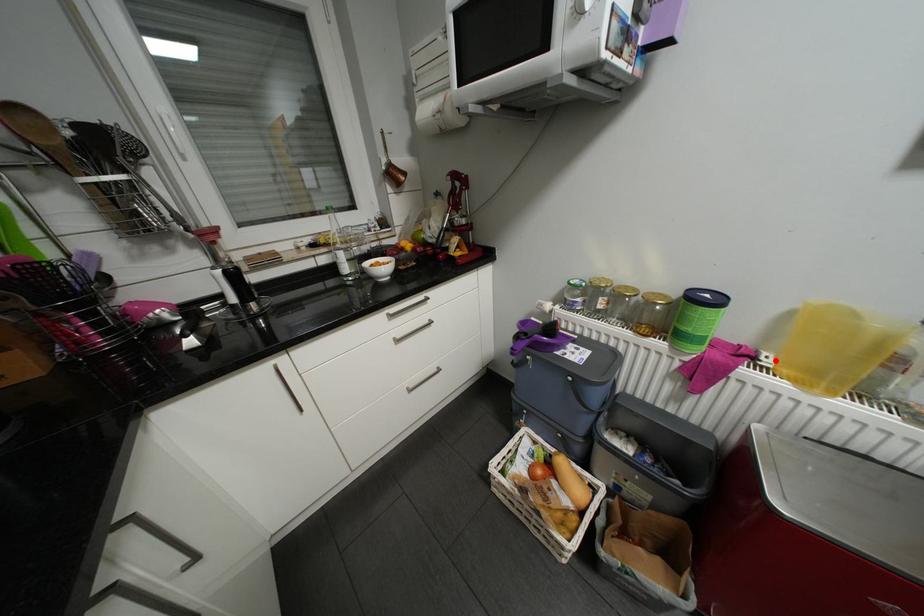
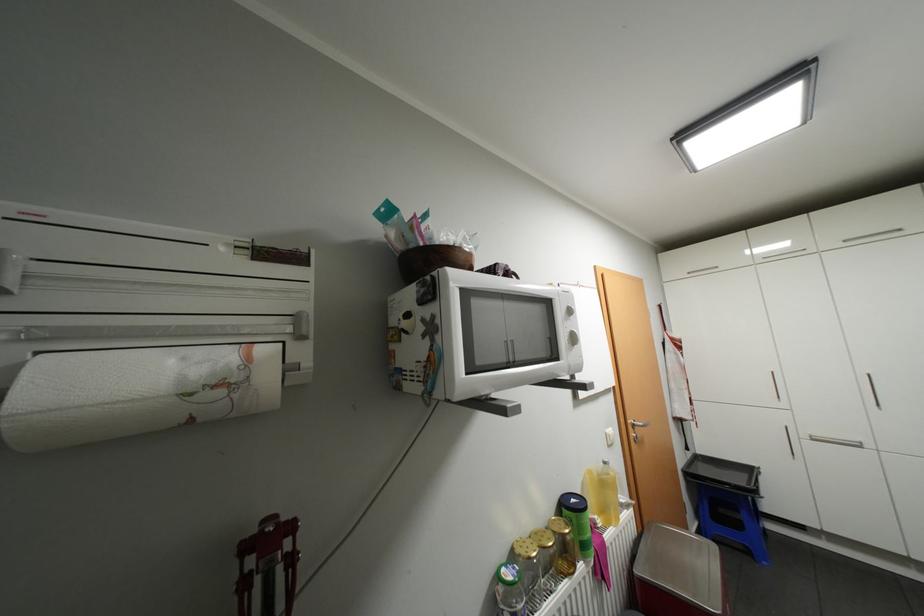
Question: I am providing you with two images of the same scene from different viewpoints. In image1, a red point is highlighted. Considering the same 3D point in image2, which of the following is correct?

Choices:
 (A) It is closer
 (B) It is farther

Answer: (B)